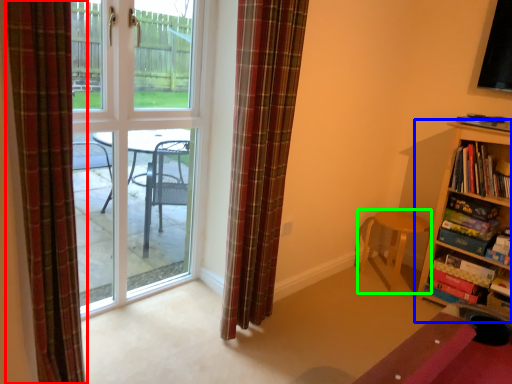
Question: Which object is positioned farthest from curtain (highlighted by a red box)? Select from bookcase (highlighted by a blue box) and chair (highlighted by a green box).

Choices:
 (A) bookcase
 (B) chair

Answer: (A)